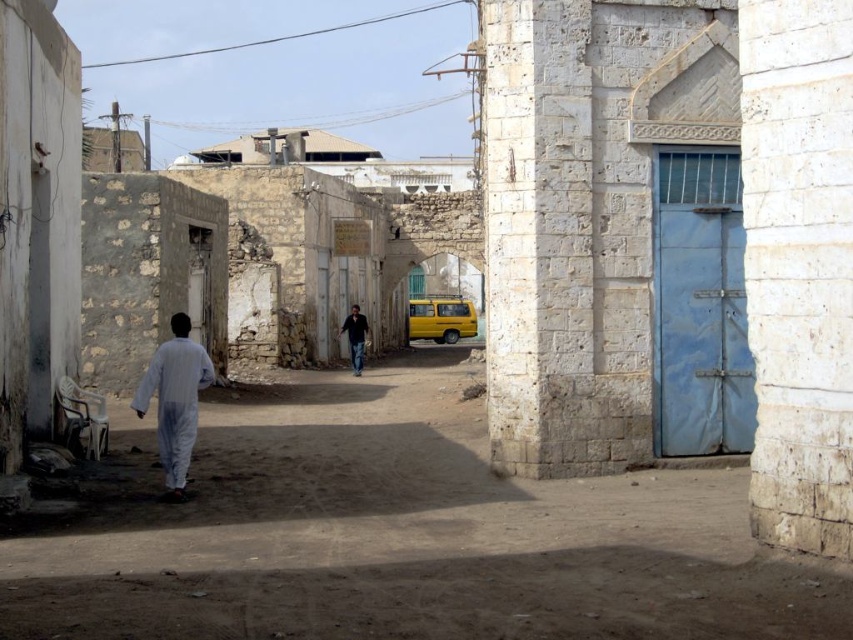
You are standing in the alleyway and want to place a small package on the ground. The package is 10 cm in height. There is a white matte clothing at left at point (175, 400). Can you place the package there without it being obstructed by the clothing?

The white matte clothing at left is located at point (175, 400). Since the package is only 10 cm tall, it can be placed there as the clothing does not obstruct the area.

You are a delivery person trying to navigate through the narrow alleyway. You see the white stone alley at center and the yellow matte school bus at center. Which object is positioned lower in the scene?

The white stone alley at center is positioned below the yellow matte school bus at center, so the white stone alley at center is lower in the scene.